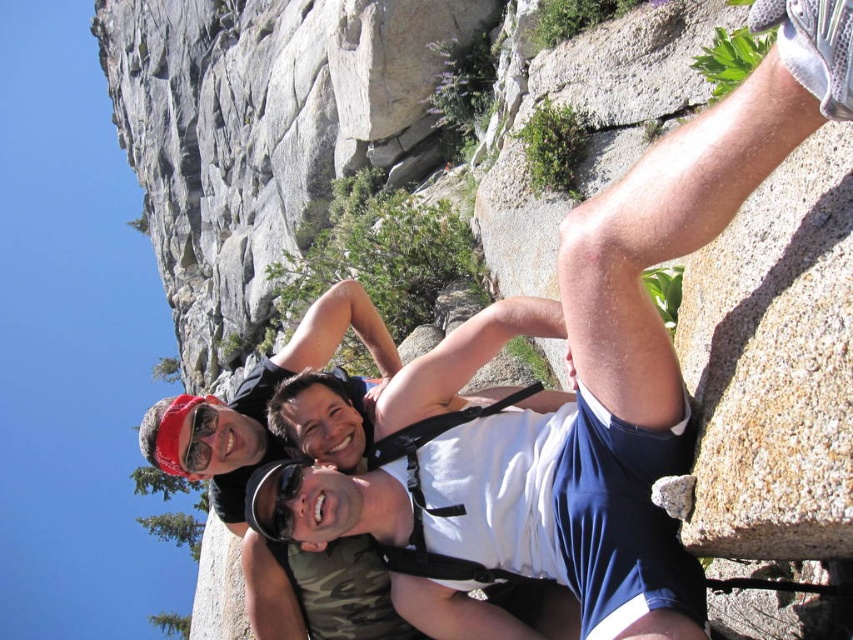
You are standing at the center of the rocky terrain and want to hand a water bottle to the person wearing the white fabric shirt at center. Which direction should you move to reach them?

The white fabric shirt at center is located at point (691, 209), so you should move towards the center area to reach them.